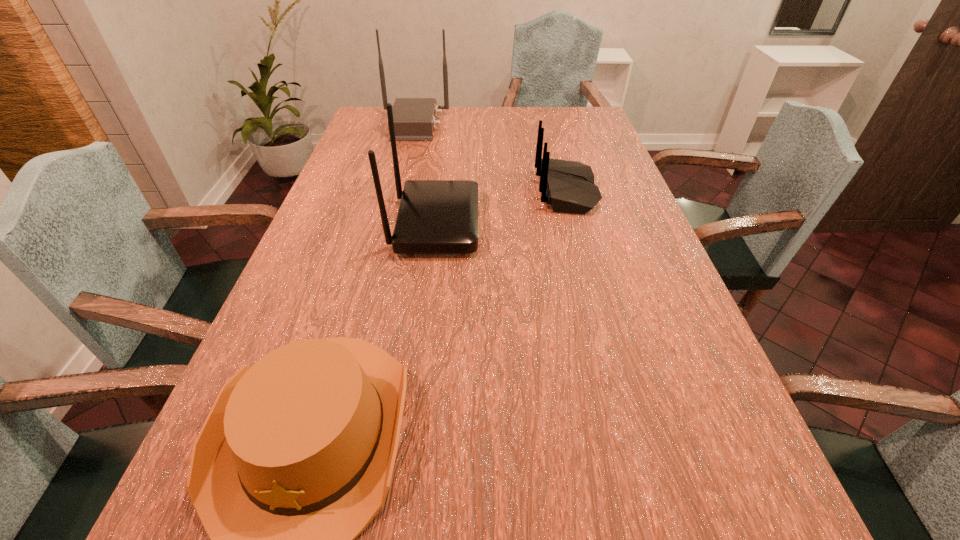
In order to click on the farthest object in this screenshot , I will do `click(414, 119)`.

Locate an element on the screen. The width and height of the screenshot is (960, 540). the third tallest object is located at coordinates (568, 186).

At what (x,y) coordinates should I click in order to perform the action: click on the shortest router. Please return your answer as a coordinate pair (x, y). Looking at the image, I should click on pos(568,186).

The width and height of the screenshot is (960, 540). In order to click on free space located on the back of the farthest router to connect cables in this screenshot , I will do `click(511, 125)`.

In order to click on vacant space located on the back of the rightmost router in this screenshot , I will do `click(423, 191)`.

The image size is (960, 540). What are the coordinates of `free spot located on the back of the rightmost router` in the screenshot? It's located at (431, 191).

Find the location of a particular element. The width and height of the screenshot is (960, 540). vacant region located 0.060m on the back of the rightmost router is located at coordinates (516, 191).

At what (x,y) coordinates should I click in order to perform the action: click on object that is at the far edge. Please return your answer as a coordinate pair (x, y). The height and width of the screenshot is (540, 960). Looking at the image, I should click on (414, 119).

The height and width of the screenshot is (540, 960). I want to click on object present at the left edge, so click(414, 119).

This screenshot has height=540, width=960. I want to click on object positioned at the right edge, so click(568, 186).